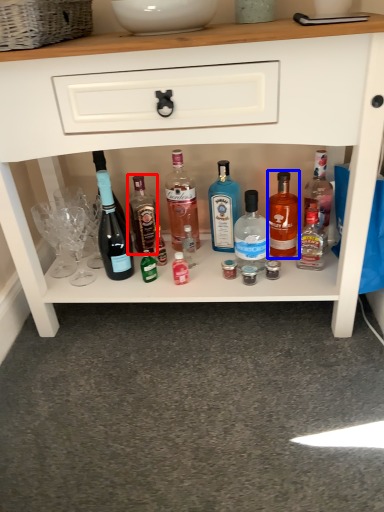
Question: Which object is closer to the camera taking this photo, bottle (highlighted by a red box) or bottle (highlighted by a blue box)?

Choices:
 (A) bottle
 (B) bottle

Answer: (B)